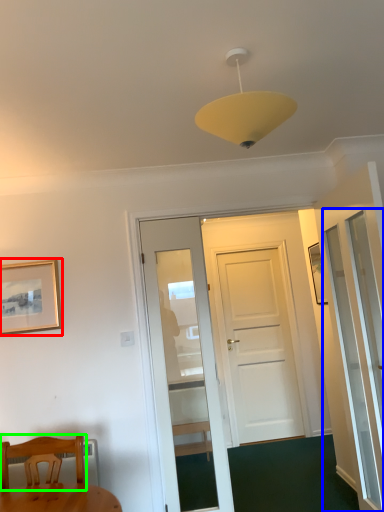
Question: Which is farther away from picture frame (highlighted by a red box)? screen door (highlighted by a blue box) or chair (highlighted by a green box)?

Choices:
 (A) screen door
 (B) chair

Answer: (A)